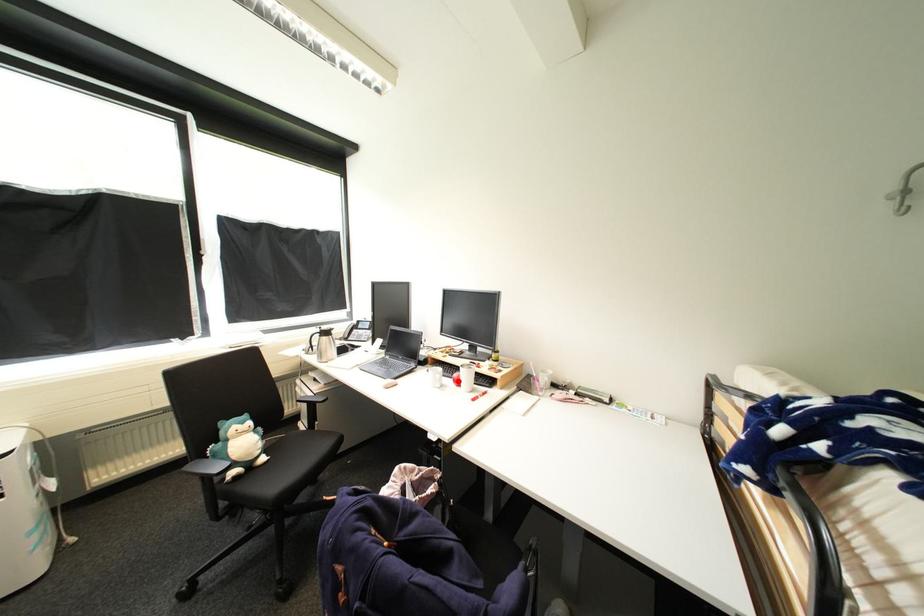
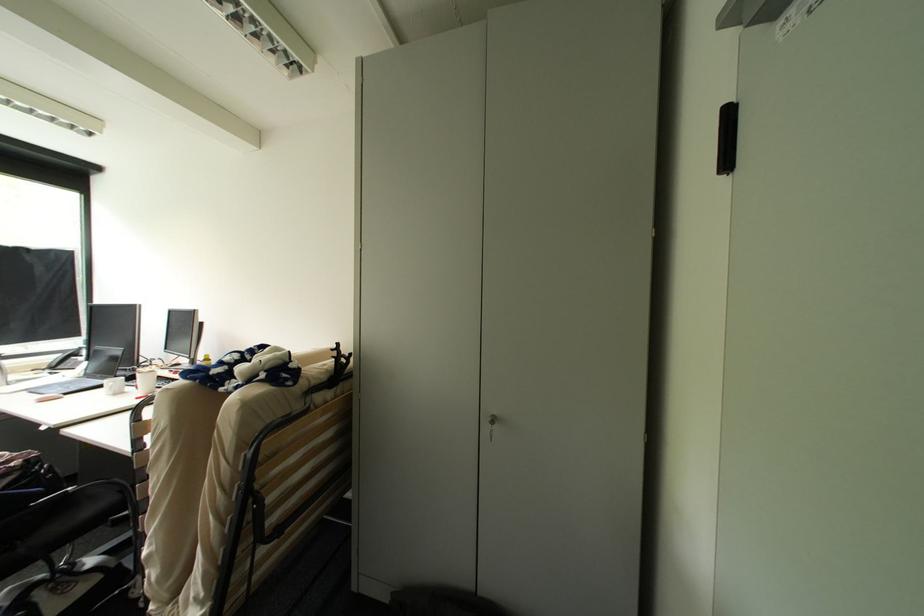
Question: I am providing you with two images of the same scene from different viewpoints. A red point is shown in image1. For the corresponding object point in image2, is it positioned nearer or farther from the camera?

Choices:
 (A) Nearer
 (B) Farther

Answer: (A)